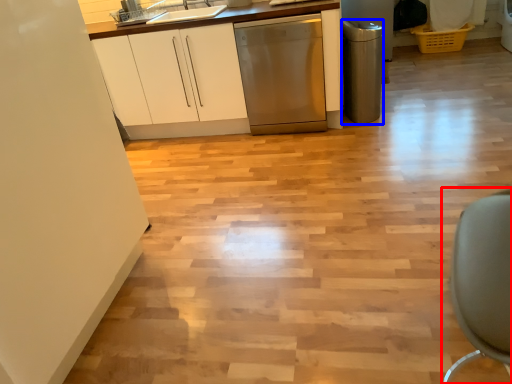
Question: Among these objects, which one is nearest to the camera, swivel chair (highlighted by a red box) or appliance (highlighted by a blue box)?

Choices:
 (A) swivel chair
 (B) appliance

Answer: (A)